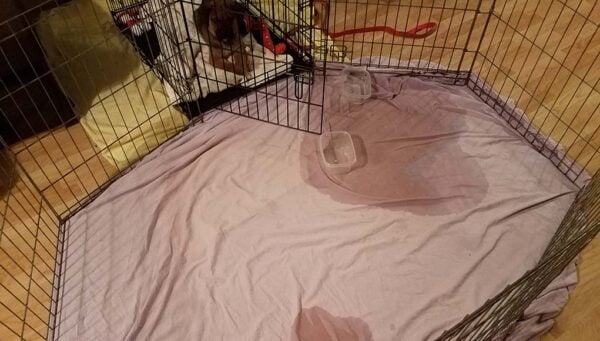
Image resolution: width=600 pixels, height=341 pixels. What are the coordinates of `wood floor` in the screenshot? It's located at (59, 152).